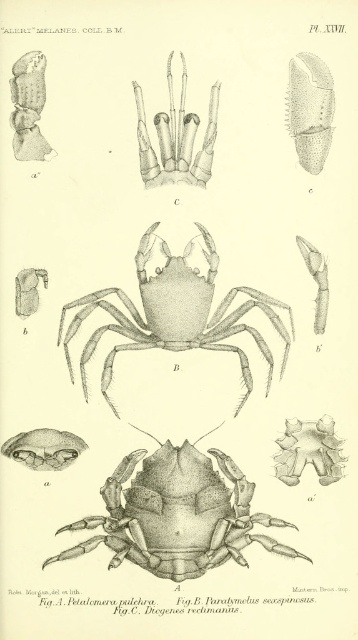
Question: Which point is closer to the camera taking this photo?

Choices:
 (A) 40,72
 (B) 31,304

Answer: (A)

Question: Can you confirm if smooth gray claw at center is positioned to the left of serrated brown claw at upper right?

Choices:
 (A) yes
 (B) no

Answer: (A)

Question: Which point is closer to the camera?

Choices:
 (A) smooth gray crab at center
 (B) matte gray claw at upper left

Answer: (B)

Question: Which object appears closest to the camera in this image?

Choices:
 (A) serrated brown claw at upper right
 (B) grayish-brown textured crab at center
 (C) smooth gray crab at center
 (D) matte gray claw at upper left

Answer: (D)

Question: In this image, where is grayish-brown textured crab at center located relative to matte gray insect at upper left?

Choices:
 (A) left
 (B) right

Answer: (B)

Question: Is smooth gray crab at center bigger than gray dotted crab at center?

Choices:
 (A) no
 (B) yes

Answer: (B)